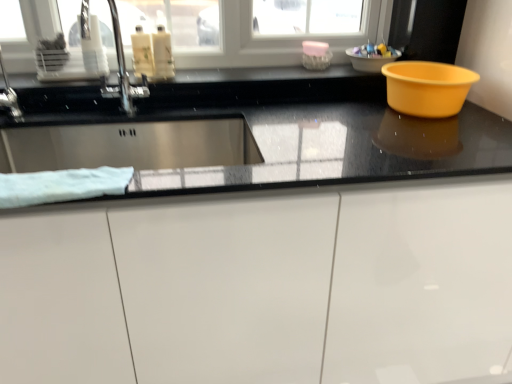
In order to click on free space to the left of metallic faucet at upper left in this screenshot , I will do `click(70, 115)`.